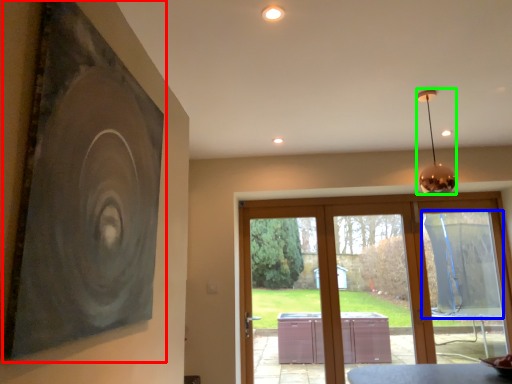
Question: Which object is the closest to the picture frame (highlighted by a red box)? Choose among these: window screen (highlighted by a blue box) or lamp (highlighted by a green box).

Choices:
 (A) window screen
 (B) lamp

Answer: (B)